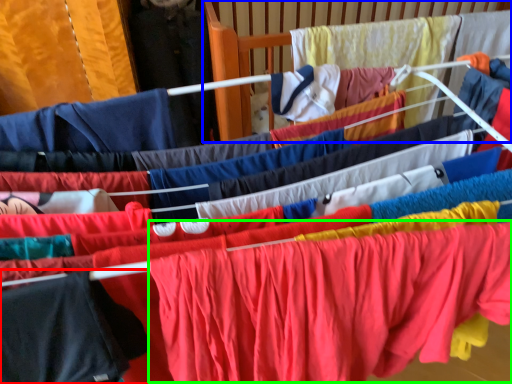
Question: Estimate the real-world distances between objects in this image. Which object is farther from clothing (highlighted by a red box), infant bed (highlighted by a blue box) or clothing (highlighted by a green box)?

Choices:
 (A) infant bed
 (B) clothing

Answer: (A)